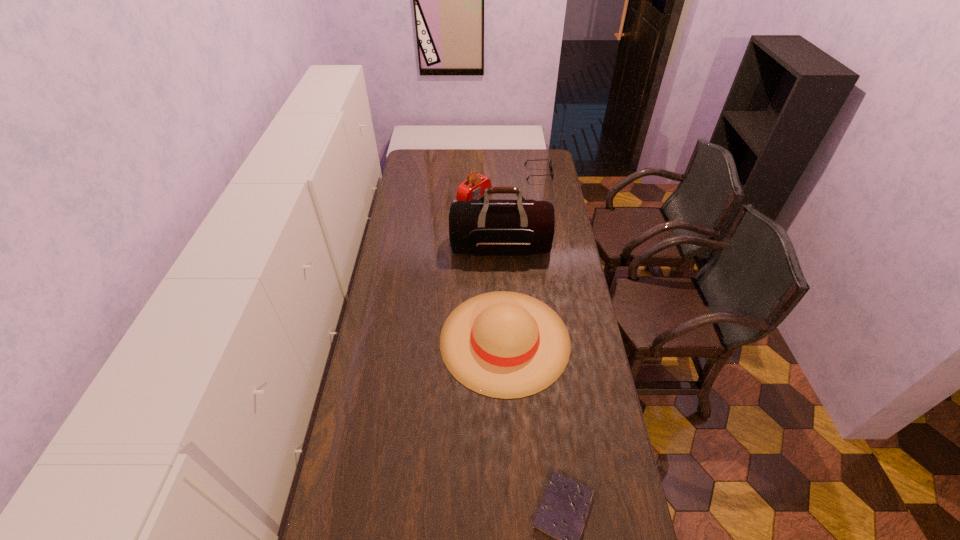
This screenshot has width=960, height=540. In order to click on vacant space that's between the fourth nearest object and the spectacles in this screenshot , I will do `click(507, 184)`.

Locate an element on the screen. The width and height of the screenshot is (960, 540). free area in between the toaster and the spectacles is located at coordinates (507, 184).

The height and width of the screenshot is (540, 960). Find the location of `free area in between the farthest object and the fourth nearest object`. free area in between the farthest object and the fourth nearest object is located at coordinates (507, 184).

Where is `free space that is in between the fourth tallest object and the sombrero`? The image size is (960, 540). free space that is in between the fourth tallest object and the sombrero is located at coordinates (521, 256).

Identify which object is the second nearest to the third nearest object. Please provide its 2D coordinates. Your answer should be formatted as a tuple, i.e. [(x, y)], where the tuple contains the x and y coordinates of a point satisfying the conditions above.

[(473, 188)]

Where is `object that ranks as the fourth closest to the fourth nearest object`? The height and width of the screenshot is (540, 960). object that ranks as the fourth closest to the fourth nearest object is located at coordinates (562, 515).

Locate an element on the screen. The height and width of the screenshot is (540, 960). vacant space that satisfies the following two spatial constraints: 1. on the front-facing side of the farthest object; 2. on the front pocket of the tallest object is located at coordinates (551, 247).